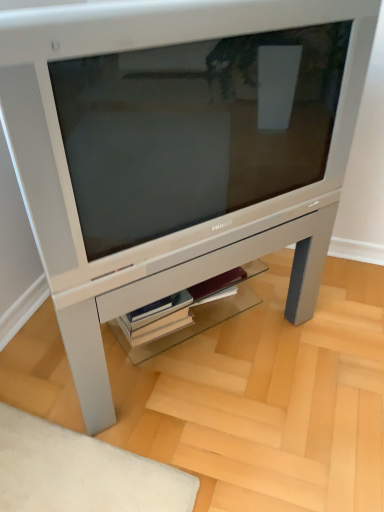
Find the location of a particular element. This screenshot has height=512, width=384. free space in front of satin silver table at center is located at coordinates coord(192,443).